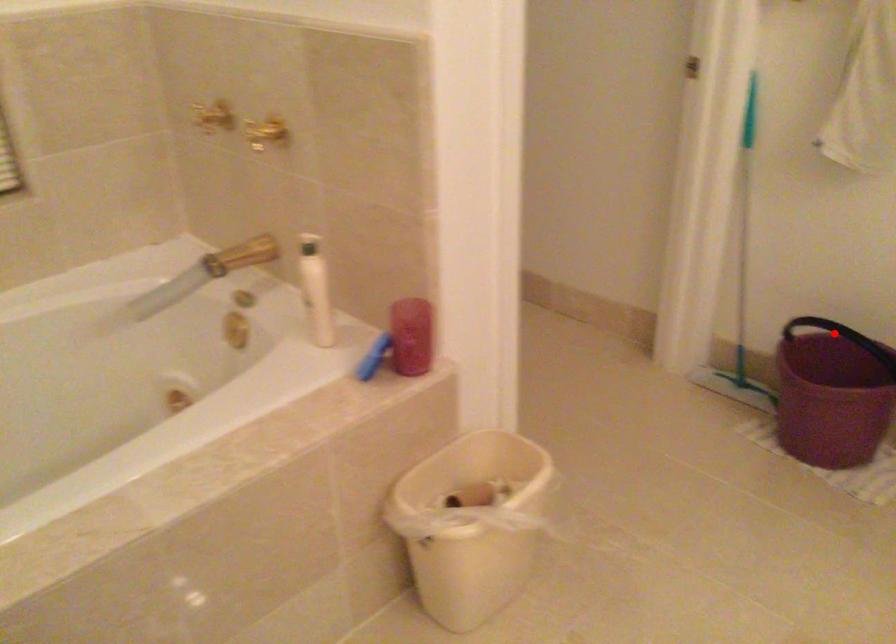
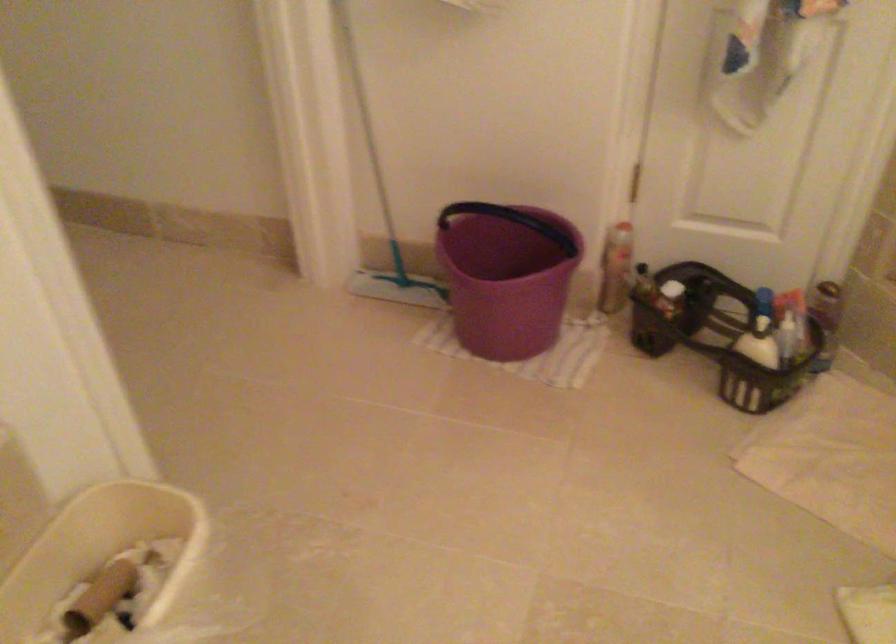
Question: I am providing you with two images of the same scene from different viewpoints. A red point is marked on the first image. Can you still see the location of the red point in image 2?

Choices:
 (A) Yes
 (B) No

Answer: (B)